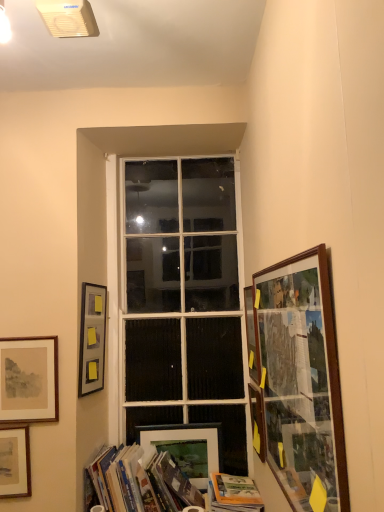
Question: Is matte white picture frame at lower center, which is the fourth picture frame in left-to-right order, positioned with its back to matte paper picture frame at lower left, the second picture frame when ordered from left to right?

Choices:
 (A) no
 (B) yes

Answer: (A)

Question: Does matte white picture frame at lower center, which is the fourth picture frame in left-to-right order, lie in front of matte paper picture frame at lower left, which appears as the 6th picture frame when viewed from the right?

Choices:
 (A) no
 (B) yes

Answer: (A)

Question: Considering the relative sizes of matte white picture frame at lower center, which is the fourth picture frame in left-to-right order, and matte paper picture frame at lower left, the second picture frame when ordered from left to right, in the image provided, is matte white picture frame at lower center, which is the fourth picture frame in left-to-right order, smaller than matte paper picture frame at lower left, the second picture frame when ordered from left to right,?

Choices:
 (A) no
 (B) yes

Answer: (B)

Question: Is matte white picture frame at lower center, the 4th picture frame when ordered from right to left, to the left of matte paper picture frame at lower left, which appears as the 6th picture frame when viewed from the right, from the viewer's perspective?

Choices:
 (A) yes
 (B) no

Answer: (B)

Question: Does matte white picture frame at lower center, which is the fourth picture frame in left-to-right order, appear on the right side of matte paper picture frame at lower left, the second picture frame when ordered from left to right?

Choices:
 (A) no
 (B) yes

Answer: (B)

Question: Is matte white picture frame at lower center, the 4th picture frame when ordered from right to left, far away from matte paper picture frame at lower left, the second picture frame when ordered from left to right?

Choices:
 (A) yes
 (B) no

Answer: (B)

Question: Can you confirm if hardcover books at lower center, acting as the 1th book starting from the left, is shorter than wooden picture frame at right, the 3th picture frame positioned from the right?

Choices:
 (A) no
 (B) yes

Answer: (B)

Question: Is hardcover books at lower center, acting as the 1th book starting from the left, touching wooden picture frame at right, the fifth picture frame when ordered from left to right?

Choices:
 (A) no
 (B) yes

Answer: (A)

Question: Is hardcover books at lower center, acting as the 1th book starting from the left, thinner than wooden picture frame at right, the 3th picture frame positioned from the right?

Choices:
 (A) yes
 (B) no

Answer: (B)

Question: Does hardcover books at lower center, acting as the 1th book starting from the left, lie in front of wooden picture frame at right, the 3th picture frame positioned from the right?

Choices:
 (A) yes
 (B) no

Answer: (A)

Question: Is hardcover books at lower center, acting as the 1th book starting from the left, not inside wooden picture frame at right, the 3th picture frame positioned from the right?

Choices:
 (A) no
 (B) yes

Answer: (B)

Question: Is hardcover books at lower center, acting as the 1th book starting from the left, far from wooden picture frame at right, the fifth picture frame when ordered from left to right?

Choices:
 (A) yes
 (B) no

Answer: (B)

Question: Are wooden framed map at right, arranged as the 1th picture frame when viewed from the right, and hardcover books at lower center, acting as the 1th book starting from the left, beside each other?

Choices:
 (A) no
 (B) yes

Answer: (A)